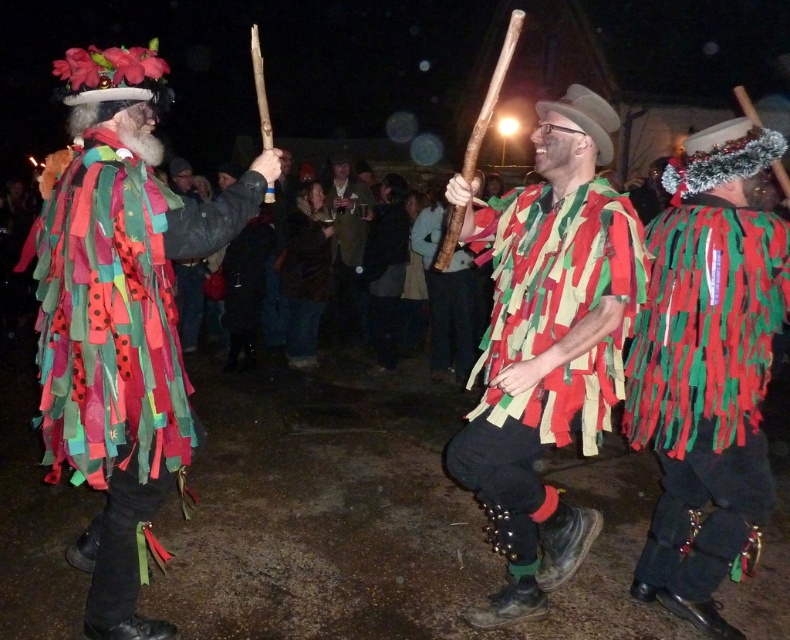
Is multicolored fabric costume at left to the right of dark brown leather jacket at center from the viewer's perspective?

Incorrect, multicolored fabric costume at left is not on the right side of dark brown leather jacket at center.

The image size is (790, 640). In order to click on multicolored fabric costume at left in this screenshot , I will do `click(119, 317)`.

Where is `multicolored fabric costume at left`? This screenshot has height=640, width=790. multicolored fabric costume at left is located at coordinates (119, 317).

Is matte green and red fabric at center thinner than velvet brown vest at center?

No.

Does matte green and red fabric at center have a larger size compared to velvet brown vest at center?

Yes.

Does point (506, 481) come in front of point (298, 209)?

Yes, point (506, 481) is in front of point (298, 209).

At what (x,y) coordinates should I click in order to perform the action: click on matte green and red fabric at center. Please return your answer as a coordinate pair (x, y). This screenshot has height=640, width=790. Looking at the image, I should click on (546, 346).

Is matte green and red fabric at center positioned before dark brown leather jacket at center?

Yes, it is.

Which is in front, point (589, 282) or point (337, 182)?

Point (589, 282)

What are the coordinates of `matte green and red fabric at center` in the screenshot? It's located at (546, 346).

The width and height of the screenshot is (790, 640). I want to click on matte green and red fabric at center, so click(546, 346).